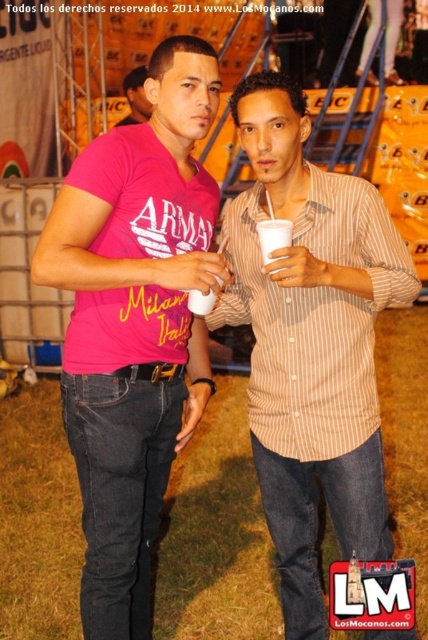
You are standing at the point labeled point [131,76]. There are two people in front of you at this event. How far apart are the two people from each other?

The two people are 5.43 meters apart from each other.